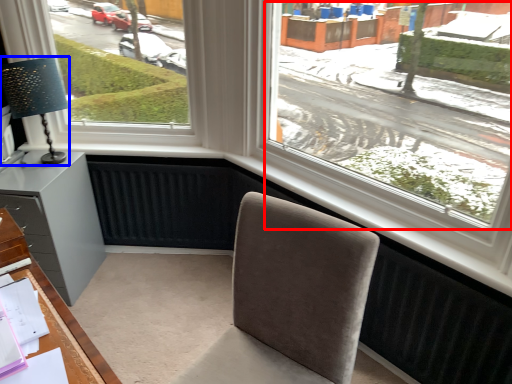
Question: Which of the following is the closest to the observer, window screen (highlighted by a red box) or table lamp (highlighted by a blue box)?

Choices:
 (A) window screen
 (B) table lamp

Answer: (A)